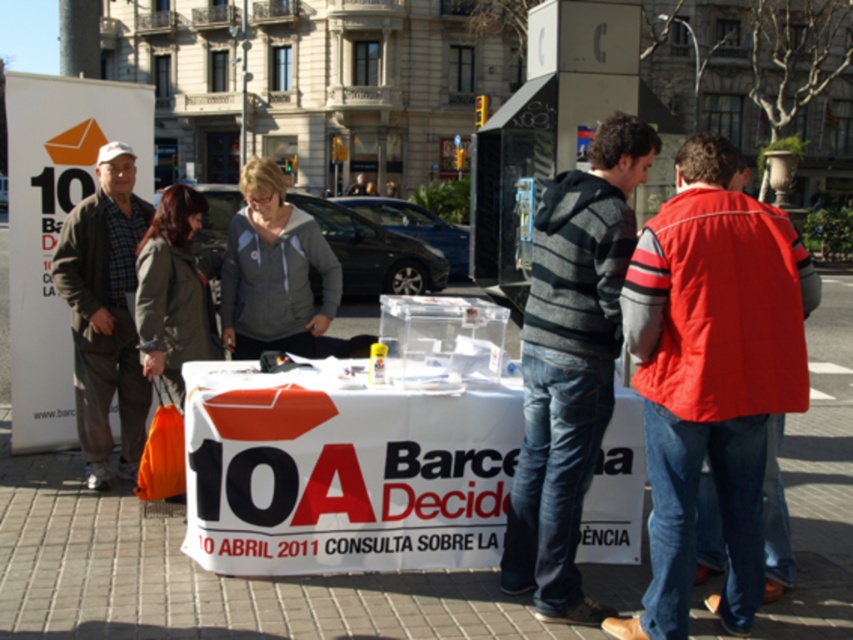
You are organizing a charity event and need to decide which jacket to use as a donation bin. The red nylon jacket at center and the gray fleece jacket at center are both available. Which jacket can hold more items due to its size?

The red nylon jacket at center is bigger than the gray fleece jacket at center, so it can hold more items.

You are at the consultation table and want to place a new document on the white paper table at center. Where should you place it to ensure it doesn not overlap with the existing items? The coordinates of the table are given as point (343, 472). Please provide the coordinates for the new document placement.

The white paper table at center is located at coordinates (343, 472). To avoid overlapping with existing items, place the new document near the edge of the table at coordinates 0.75, 0.42.